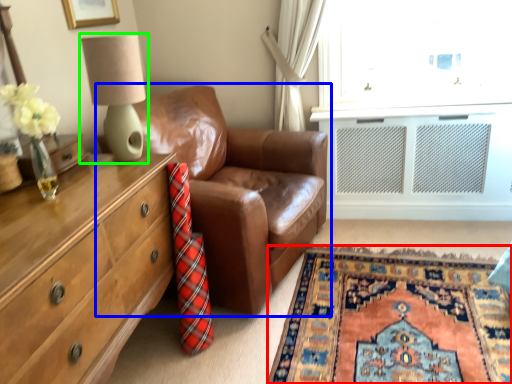
Question: Considering the real-world distances, which object is closest to plain (highlighted by a red box)? studio couch (highlighted by a blue box) or table lamp (highlighted by a green box).

Choices:
 (A) studio couch
 (B) table lamp

Answer: (A)